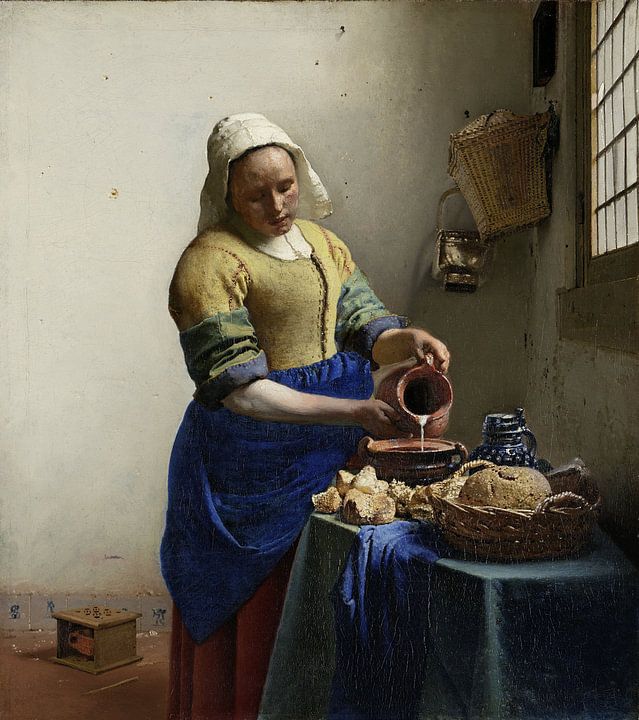
Image resolution: width=639 pixels, height=720 pixels. What are the coordinates of `tablecover` in the screenshot? It's located at (500, 572).